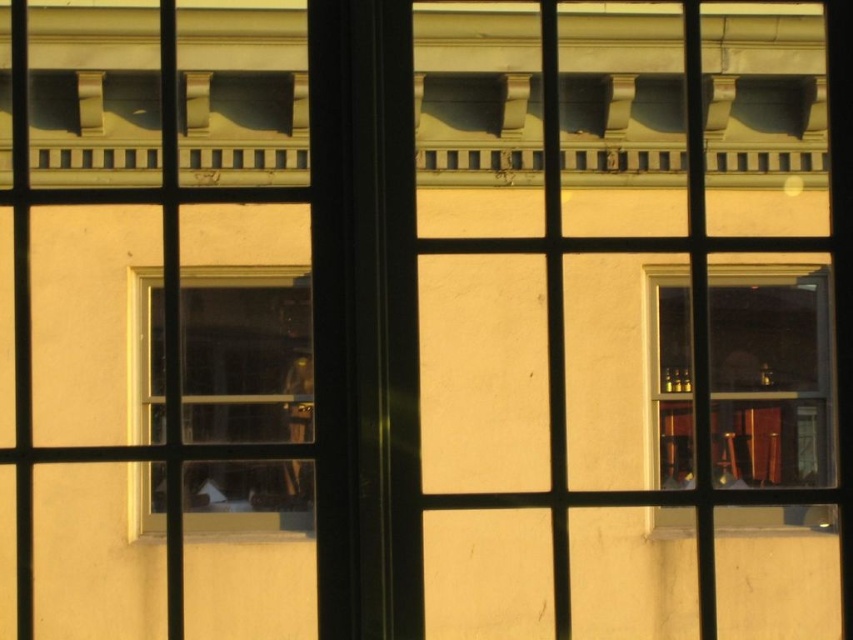
This screenshot has height=640, width=853. What are the coordinates of `transparent glass window at center` in the screenshot? It's located at (245, 355).

What do you see at coordinates (245, 355) in the screenshot? The width and height of the screenshot is (853, 640). I see `transparent glass window at center` at bounding box center [245, 355].

Which is behind, point (279, 348) or point (680, 410)?

The point (680, 410) is more distant.

This screenshot has width=853, height=640. Identify the location of transparent glass window at center. (245, 355).